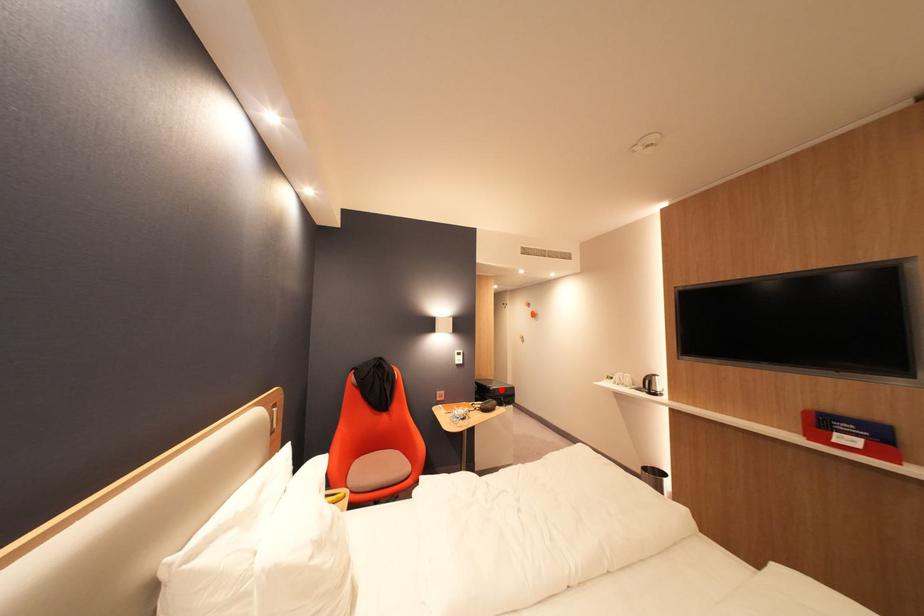
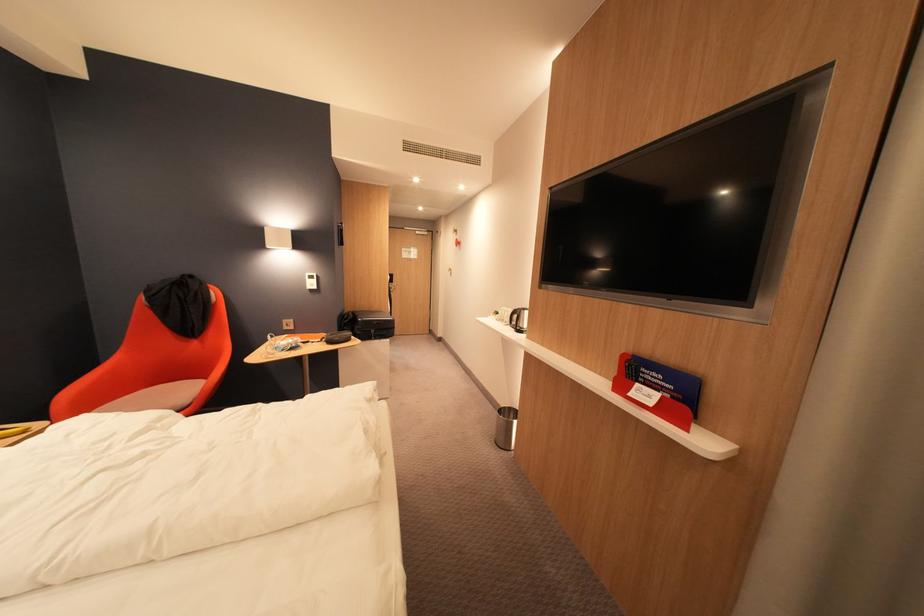
Find the pixel in the second image that matches the highlighted location in the first image.

(370, 321)